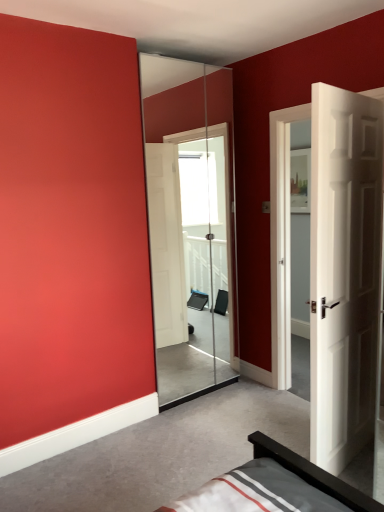
Question: Considering the relative sizes of transparent glass screen door at center and white wooden door at right in the image provided, is transparent glass screen door at center taller than white wooden door at right?

Choices:
 (A) no
 (B) yes

Answer: (B)

Question: Is transparent glass screen door at center facing away from white wooden door at right?

Choices:
 (A) yes
 (B) no

Answer: (A)

Question: Considering the relative sizes of transparent glass screen door at center and white wooden door at right in the image provided, is transparent glass screen door at center smaller than white wooden door at right?

Choices:
 (A) yes
 (B) no

Answer: (A)

Question: Does transparent glass screen door at center appear on the left side of white wooden door at right?

Choices:
 (A) no
 (B) yes

Answer: (B)

Question: Would you say transparent glass screen door at center is outside white wooden door at right?

Choices:
 (A) yes
 (B) no

Answer: (A)

Question: From a real-world perspective, is transparent glass screen door at center under white wooden door at right?

Choices:
 (A) yes
 (B) no

Answer: (B)

Question: Is white wooden door at right positioned beyond the bounds of transparent glass screen door at center?

Choices:
 (A) yes
 (B) no

Answer: (A)

Question: Is white wooden door at right positioned with its back to transparent glass screen door at center?

Choices:
 (A) no
 (B) yes

Answer: (B)

Question: Is white wooden door at right far from transparent glass screen door at center?

Choices:
 (A) no
 (B) yes

Answer: (B)

Question: Does white wooden door at right lie in front of transparent glass screen door at center?

Choices:
 (A) no
 (B) yes

Answer: (B)

Question: Is white wooden door at right further to the viewer compared to transparent glass screen door at center?

Choices:
 (A) yes
 (B) no

Answer: (B)

Question: Is white wooden door at right touching transparent glass screen door at center?

Choices:
 (A) yes
 (B) no

Answer: (B)

Question: Visually, is transparent glass screen door at center positioned to the left or to the right of white wooden door at right?

Choices:
 (A) right
 (B) left

Answer: (B)